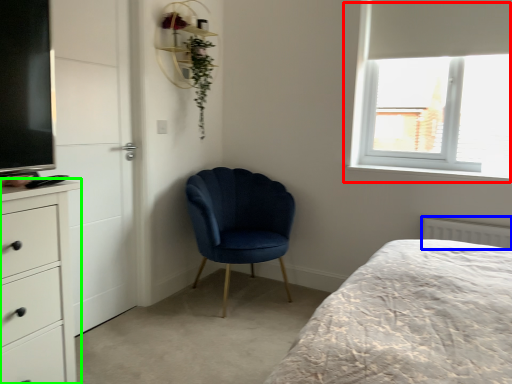
Question: Based on their relative distances, which object is nearer to window (highlighted by a red box)? Choose from radiator (highlighted by a blue box) and chest of drawers (highlighted by a green box).

Choices:
 (A) radiator
 (B) chest of drawers

Answer: (A)